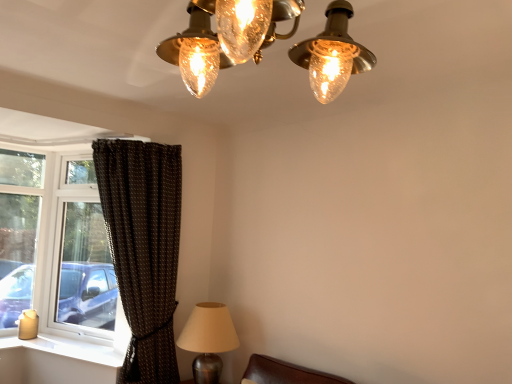
Question: From the image's perspective, is metallic silver lamp at lower left beneath clear glass window at left?

Choices:
 (A) no
 (B) yes

Answer: (B)

Question: Considering the relative sizes of metallic silver lamp at lower left and clear glass window at left in the image provided, is metallic silver lamp at lower left bigger than clear glass window at left?

Choices:
 (A) yes
 (B) no

Answer: (B)

Question: Can you confirm if metallic silver lamp at lower left is positioned to the right of clear glass window at left?

Choices:
 (A) no
 (B) yes

Answer: (B)

Question: Does metallic silver lamp at lower left come in front of clear glass window at left?

Choices:
 (A) yes
 (B) no

Answer: (A)

Question: Is metallic silver lamp at lower left smaller than clear glass window at left?

Choices:
 (A) no
 (B) yes

Answer: (B)

Question: Is white plastic window sill at lower left situated inside metallic silver lamp at lower left or outside?

Choices:
 (A) outside
 (B) inside

Answer: (A)

Question: In the image, is white plastic window sill at lower left on the left side or the right side of metallic silver lamp at lower left?

Choices:
 (A) left
 (B) right

Answer: (A)

Question: From the image's perspective, relative to metallic silver lamp at lower left, is white plastic window sill at lower left above or below?

Choices:
 (A) below
 (B) above

Answer: (A)

Question: Relative to metallic silver lamp at lower left, is white plastic window sill at lower left in front or behind?

Choices:
 (A) front
 (B) behind

Answer: (B)

Question: Do you think clear glass window at left is within brown textured curtain at left, or outside of it?

Choices:
 (A) inside
 (B) outside

Answer: (B)

Question: Is clear glass window at left to the left or to the right of brown textured curtain at left in the image?

Choices:
 (A) right
 (B) left

Answer: (B)

Question: Relative to brown textured curtain at left, is clear glass window at left in front or behind?

Choices:
 (A) front
 (B) behind

Answer: (B)

Question: Considering the positions of clear glass window at left and brown textured curtain at left in the image, is clear glass window at left bigger or smaller than brown textured curtain at left?

Choices:
 (A) big
 (B) small

Answer: (B)

Question: Is metallic silver lamp at lower left inside the boundaries of brown textured curtain at left, or outside?

Choices:
 (A) outside
 (B) inside

Answer: (A)

Question: Based on their positions, is metallic silver lamp at lower left located to the left or right of brown textured curtain at left?

Choices:
 (A) right
 (B) left

Answer: (A)